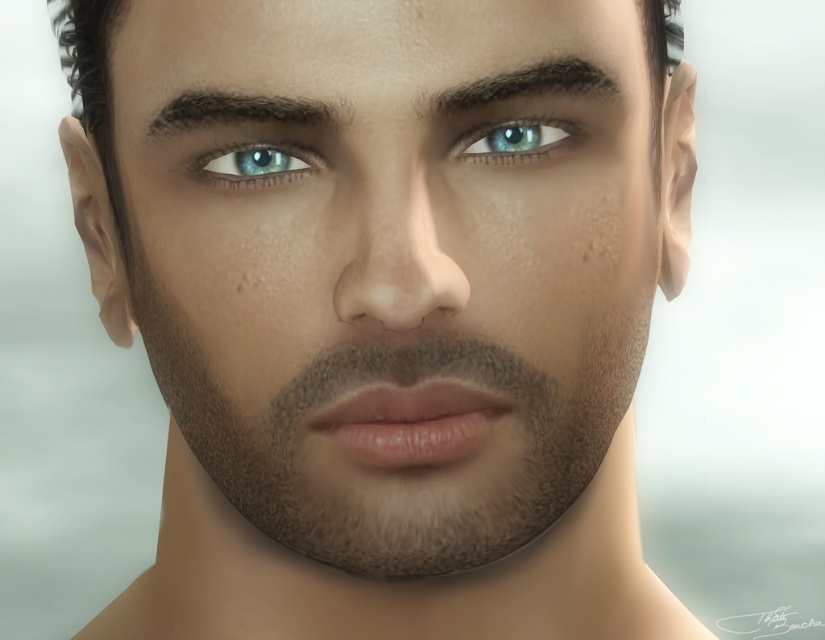
In the scene shown: Can you confirm if smooth skin face at center is shorter than dark brown textured eyebrow at upper center?

In fact, smooth skin face at center may be taller than dark brown textured eyebrow at upper center.

Can you confirm if smooth skin face at center is thinner than dark brown textured eyebrow at upper center?

No, smooth skin face at center is not thinner than dark brown textured eyebrow at upper center.

Describe the element at coordinates (390, 269) in the screenshot. The height and width of the screenshot is (640, 825). I see `smooth skin face at center` at that location.

Find the location of a particular element. smooth skin face at center is located at coordinates (390, 269).

Is smooth skin face at center below blue glossy eye at center?

Indeed, smooth skin face at center is positioned under blue glossy eye at center.

Is point (498, 417) positioned before point (536, 118)?

That is False.

At what (x,y) coordinates should I click in order to perform the action: click on smooth skin face at center. Please return your answer as a coordinate pair (x, y). Looking at the image, I should click on (390, 269).

Between point (286, 112) and point (541, 134), which one is positioned behind?

Point (541, 134)

Is dark brown textured eyebrow at upper center smaller than blue glossy eye at center?

Incorrect, dark brown textured eyebrow at upper center is not smaller in size than blue glossy eye at center.

The image size is (825, 640). In order to click on dark brown textured eyebrow at upper center in this screenshot , I will do `click(234, 109)`.